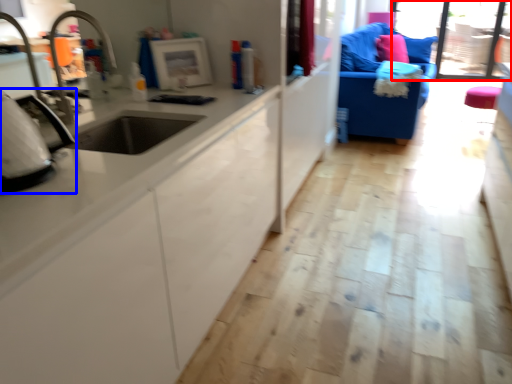
Question: Which point is closer to the camera, window screen (highlighted by a red box) or appliance (highlighted by a blue box)?

Choices:
 (A) window screen
 (B) appliance

Answer: (B)